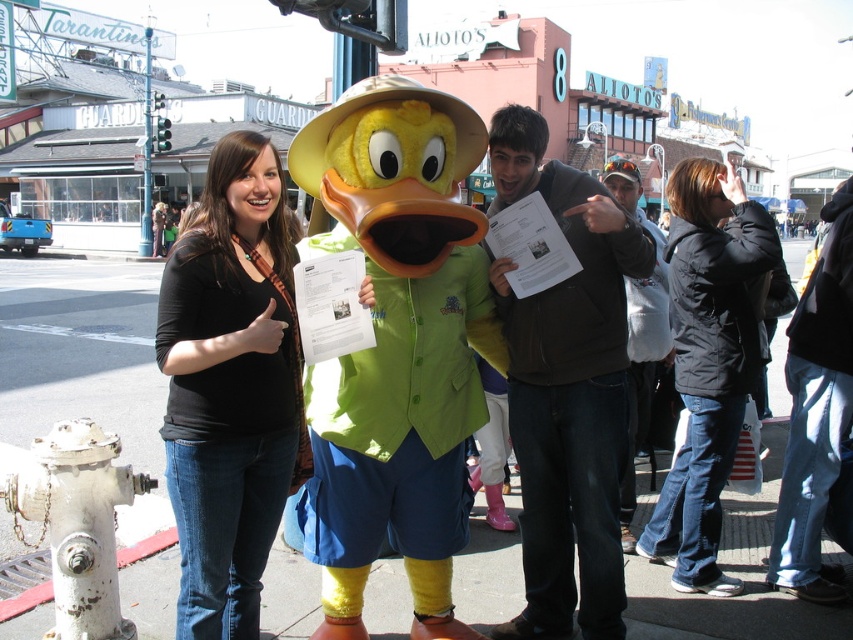
You are a photographer standing in the street scene and want to take a photo of the dark brown hoodie at center and the dark gray hoodie at center. Which hoodie should you focus on first to ensure both are in the frame?

You should focus on the dark brown hoodie at center first because it is closer to the viewer than the dark gray hoodie at center, so adjusting the focus from near to far will help both be in the frame.

You are standing at the center of the street scene and want to locate the fluffy yellow duck at center. What are the coordinates where you should look?

The fluffy yellow duck at center is located at coordinates point (397, 348).